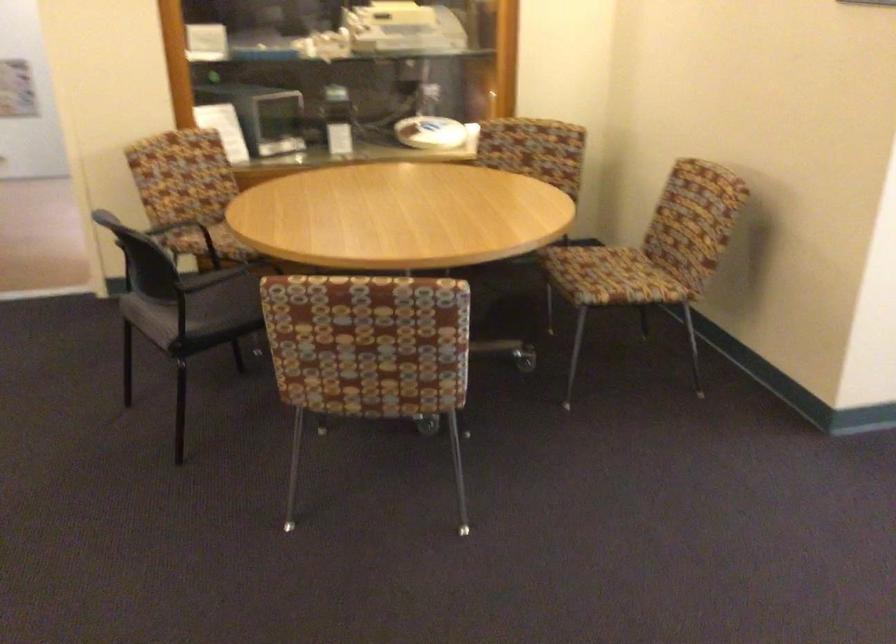
I want to click on black chair sitting surface, so pos(213,301).